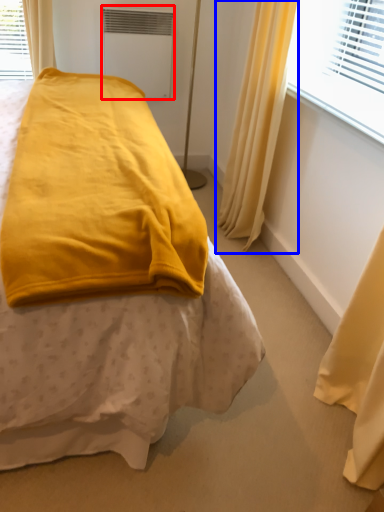
Question: Which object is closer to the camera taking this photo, air conditioning (highlighted by a red box) or curtain (highlighted by a blue box)?

Choices:
 (A) air conditioning
 (B) curtain

Answer: (B)